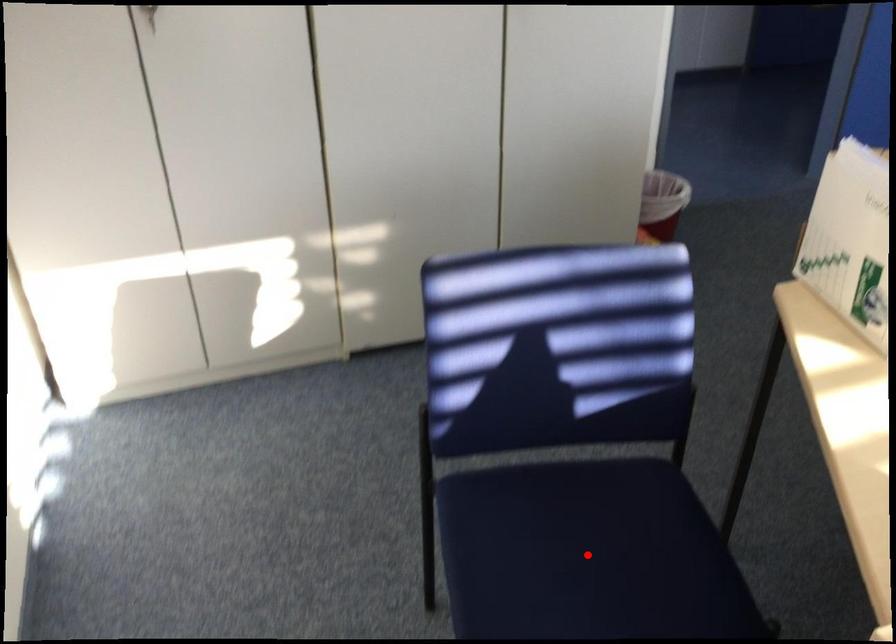
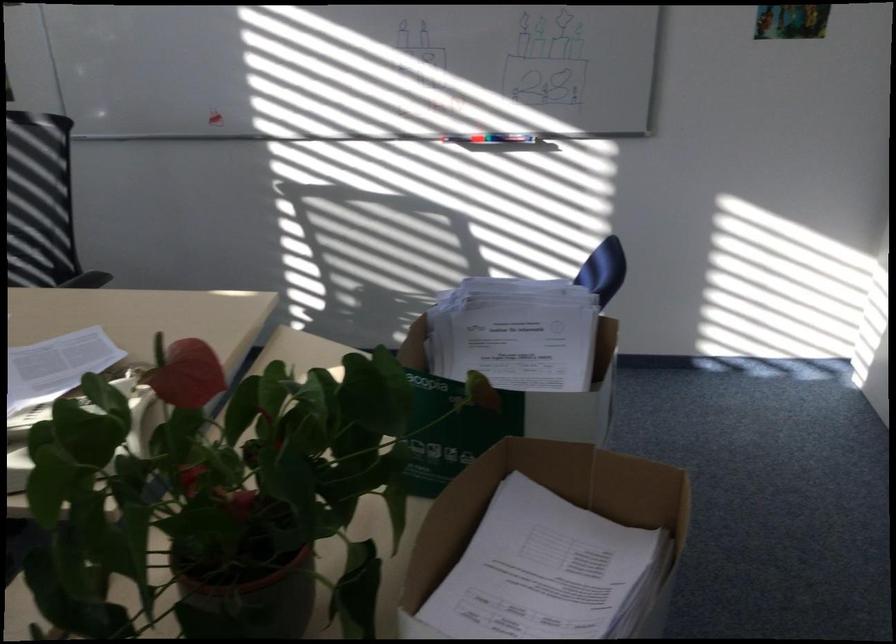
Question: I am providing you with two images of the same scene from different viewpoints. A red point is marked on the first image. Is the red point's position out of view in image 2?

Choices:
 (A) Yes
 (B) No

Answer: (A)